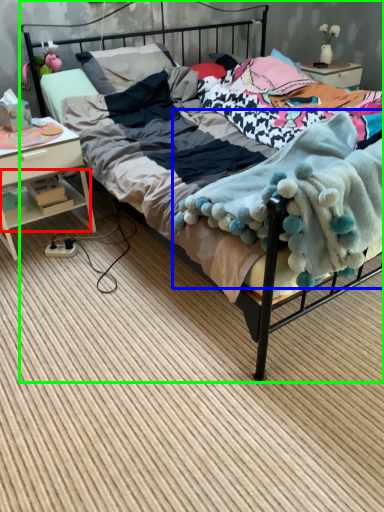
Question: Which is nearer to the shelf (highlighted by a red box)? blanket (highlighted by a blue box) or bed (highlighted by a green box).

Choices:
 (A) blanket
 (B) bed

Answer: (B)